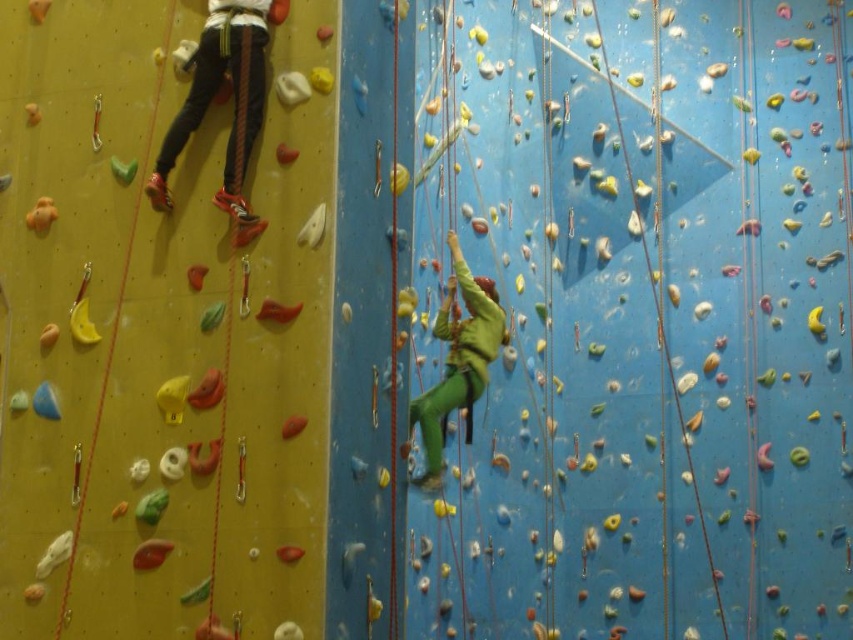
Who is higher up, matte black pants at left or green matte climbing suit at center?

matte black pants at left is higher up.

Is matte black pants at left thinner than green matte climbing suit at center?

No, matte black pants at left is not thinner than green matte climbing suit at center.

Is point (212, 70) farther from camera compared to point (428, 412)?

No, it is in front of (428, 412).

Where is `matte black pants at left`? matte black pants at left is located at coordinates (212, 97).